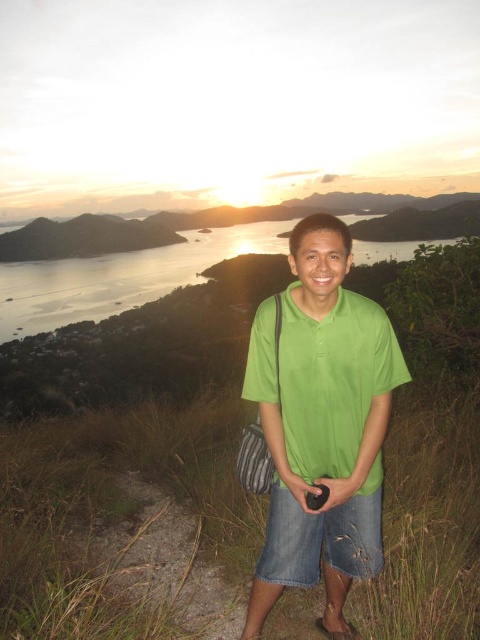
You are a fashion designer analyzing the outfit of the person in the image. Based on the scene description, can you determine the spatial relationship between the green cotton shirt at center and the denim shorts at lower center?

The green cotton shirt at center is located above the denim shorts at lower center, which is consistent with typical clothing arrangements where shirts are worn over pants or shorts.

You are standing at the camera position and want to take a photo of the point at coordinates point (348, 388). If you have a camera with a 50mm lens, which has a field of view of 46 degrees, will the point be fully visible in the photo?

The point at coordinates point (348, 388) is 9.65 feet away from the camera. To determine visibility, calculate the angle subtended by the point at the camera. If this angle is less than half the field of view, it will be fully visible. However, without knowing the size of the point, we cannot compute the exact angle. Assuming the point is small, it might fit within the 46 degree field of view. But since the distance is significant, the point may appear too small to discern clearly. The answer depends on